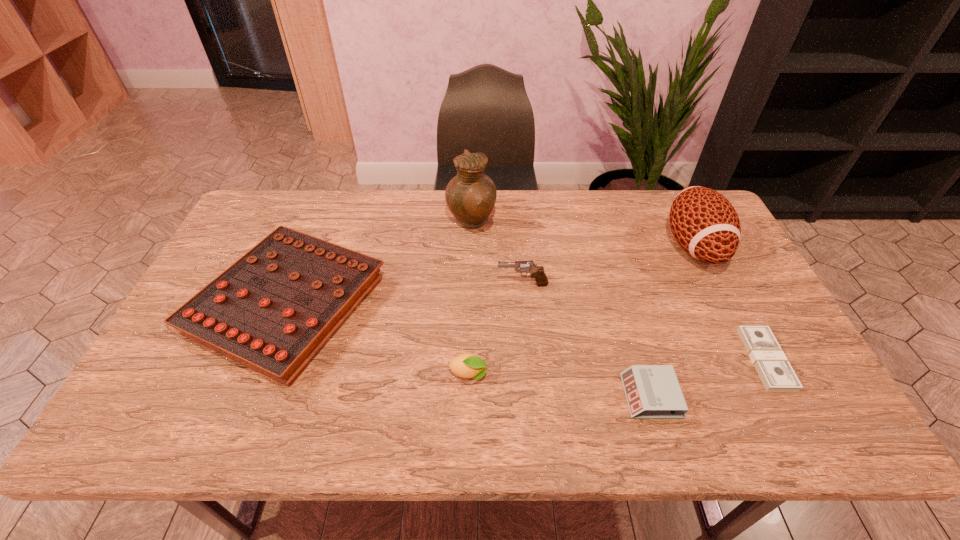
Identify the location of object that is at the near edge. (652, 391).

The width and height of the screenshot is (960, 540). I want to click on object that is at the left edge, so click(x=272, y=310).

The image size is (960, 540). What are the coordinates of `football located in the right edge section of the desktop` in the screenshot? It's located at (704, 223).

What are the coordinates of `dollar that is positioned at the right edge` in the screenshot? It's located at (777, 375).

The height and width of the screenshot is (540, 960). In order to click on object that is at the far right corner in this screenshot , I will do `click(704, 223)`.

In order to click on vacant space at the far edge of the desktop in this screenshot , I will do pyautogui.click(x=548, y=234).

In the image, there is a desktop. Find the location of `free space at the near edge`. free space at the near edge is located at coordinates (361, 424).

At what (x,y) coordinates should I click in order to perform the action: click on vacant area at the right edge of the desktop. Please return your answer as a coordinate pair (x, y). This screenshot has height=540, width=960. Looking at the image, I should click on (751, 315).

Where is `vacant area at the far left corner`? vacant area at the far left corner is located at coordinates (252, 204).

Locate an element on the screen. This screenshot has height=540, width=960. blank space at the near left corner of the desktop is located at coordinates (134, 413).